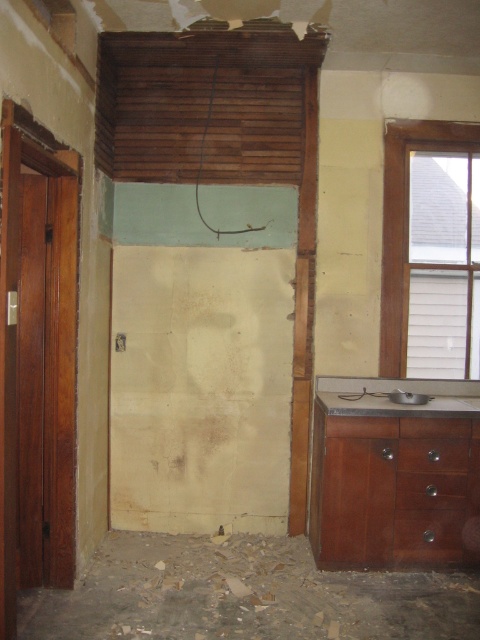
You are a plumber trying to access the pipes under the sink. You need to move the brown wooden drawer at lower right and the satin silver sink at lower right. Which object should you move first to have enough space to work?

You should move the brown wooden drawer at lower right first because it might be wider than the satin silver sink at lower right, allowing more space to access the pipes.

In the scene shown: You are a contractor assessing the room. You need to determine if the brown wooden drawer at lower right can be moved under the clear glass window at upper right. Can it fit vertically?

The clear glass window at upper right is much taller than the brown wooden drawer at lower right, so yes, the brown wooden drawer at lower right can fit vertically under the clear glass window at upper right.